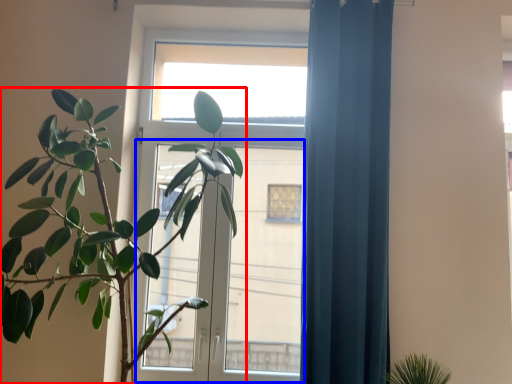
Question: Which point is further to the camera, houseplant (highlighted by a red box) or screen door (highlighted by a blue box)?

Choices:
 (A) houseplant
 (B) screen door

Answer: (B)